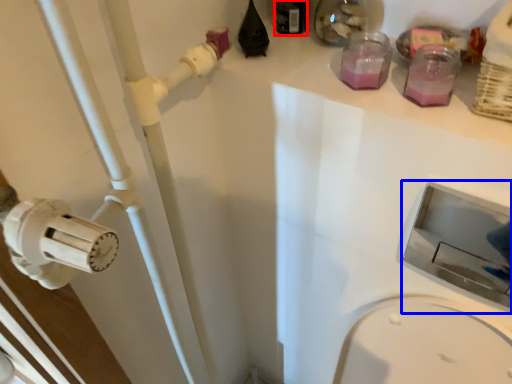
Question: Among these objects, which one is nearest to the camera, bottle (highlighted by a red box) or sink (highlighted by a blue box)?

Choices:
 (A) bottle
 (B) sink

Answer: (B)